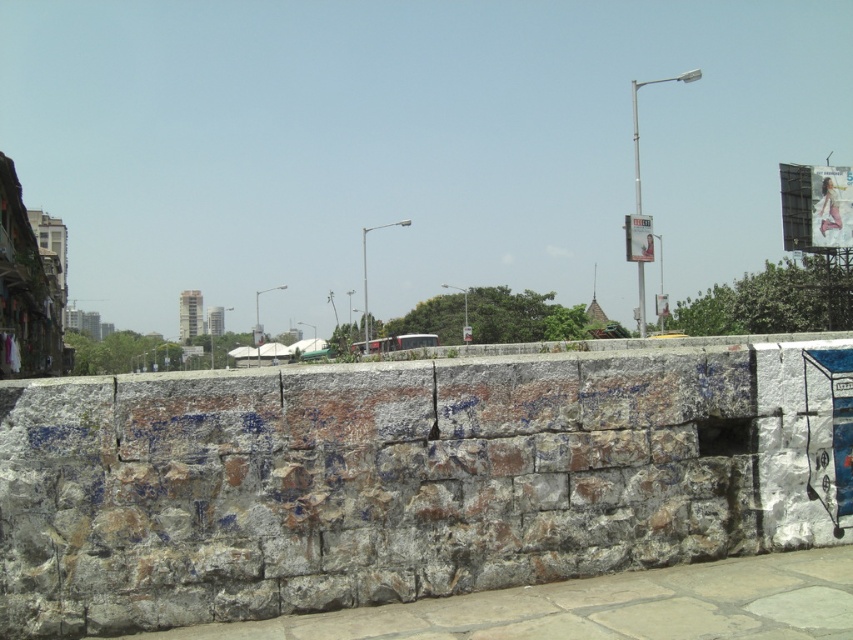
Question: Is rusty stone wall at center thinner than gray stone pavement at lower left?

Choices:
 (A) yes
 (B) no

Answer: (A)

Question: Can you confirm if rusty stone wall at center is bigger than gray stone pavement at lower left?

Choices:
 (A) no
 (B) yes

Answer: (B)

Question: Can you confirm if rusty stone wall at center is positioned below gray stone pavement at lower left?

Choices:
 (A) yes
 (B) no

Answer: (B)

Question: Which point is closer to the camera taking this photo?

Choices:
 (A) [428, 612]
 (B) [654, 342]

Answer: (A)

Question: Which point appears farthest from the camera in this image?

Choices:
 (A) (479, 596)
 (B) (9, 608)

Answer: (A)